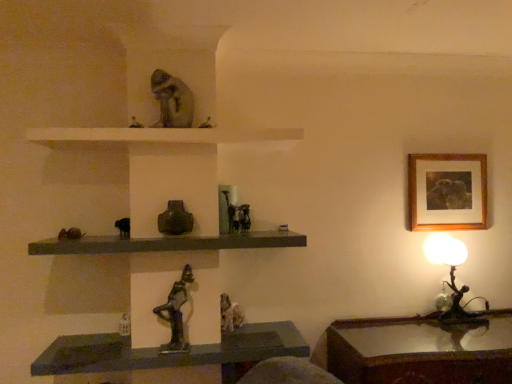
Find the location of a particular element. The width and height of the screenshot is (512, 384). free space in front of metallic statue at center, the second animal positioned from the top is located at coordinates (237, 231).